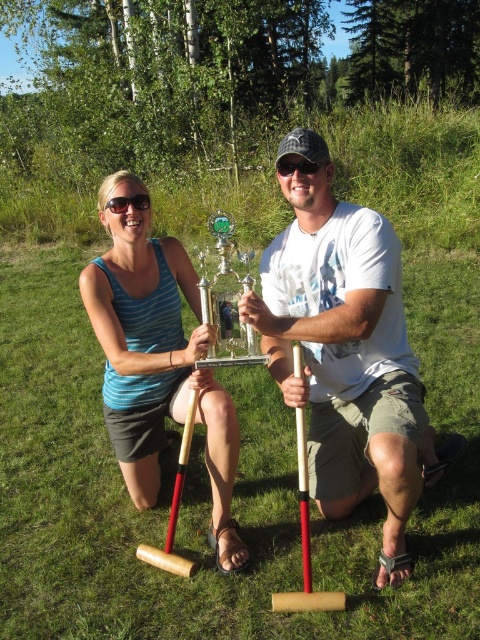
You are standing at the origin point in the image and want to reach the trophy held by the person on the right. Which of the two points, point (292,394) or point (165,291), would you pass through first on your path to the trophy?

Since point (292,394) is in front of point (165,291), you would pass through point (292,394) first on your way to the trophy held by the person on the right.

You are a photographer positioned behind both individuals in the image. You want to take a photo focusing on the white cotton shirt at center and the matte blue tank top at center. Which one will appear larger in the photo?

The white cotton shirt at center will appear larger in the photo because it is closer to the viewer than the matte blue tank top at center.

You are designing a new clothing line and need to ensure that the white cotton shirt at center and the matte blue tank top at center can be displayed side by side on a mannequin. Given that the display space allows for a maximum width of 1.2 meters, can both items fit without overlapping?

The white cotton shirt at center has a larger width than the matte blue tank top at center. Since the total width of both items combined would exceed the 1.2 meters display space, they cannot be displayed side by side without overlapping.